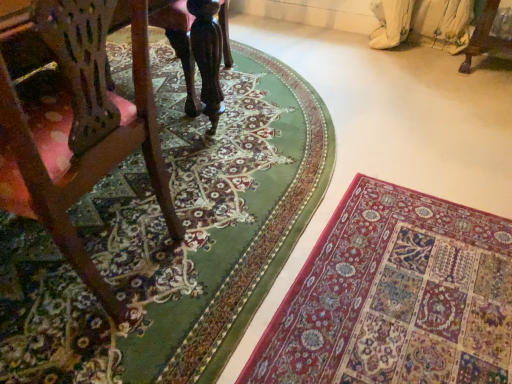
Question: Is wooden chair at left far from carpeted floor at lower right, the 1th mat when ordered from left to right?

Choices:
 (A) yes
 (B) no

Answer: (B)

Question: Is wooden chair at left closer to camera compared to carpeted floor at lower right, the 1th mat when ordered from left to right?

Choices:
 (A) yes
 (B) no

Answer: (A)

Question: From the image's perspective, is wooden chair at left beneath carpeted floor at lower right, the second mat when ordered from right to left?

Choices:
 (A) no
 (B) yes

Answer: (B)

Question: From a real-world perspective, is wooden chair at left under carpeted floor at lower right, the 1th mat when ordered from left to right?

Choices:
 (A) yes
 (B) no

Answer: (B)

Question: Can you confirm if wooden chair at left is bigger than carpeted floor at lower right, the second mat when ordered from right to left?

Choices:
 (A) no
 (B) yes

Answer: (B)

Question: From their relative heights in the image, would you say wooden chair at left is taller or shorter than carpeted floor at lower right, the second mat when ordered from right to left?

Choices:
 (A) tall
 (B) short

Answer: (A)

Question: From a real-world perspective, is wooden chair at left above or below carpeted floor at lower right, the 1th mat when ordered from left to right?

Choices:
 (A) below
 (B) above

Answer: (B)

Question: Does point (133, 137) appear closer or farther from the camera than point (270, 276)?

Choices:
 (A) closer
 (B) farther

Answer: (A)

Question: Would you say wooden chair at left is inside or outside carpeted floor at lower right, the 1th mat when ordered from left to right?

Choices:
 (A) outside
 (B) inside

Answer: (A)

Question: Is carpeted floor at lower right, the 1th mat when ordered from left to right, to the left or to the right of wooden chair at left in the image?

Choices:
 (A) left
 (B) right

Answer: (B)

Question: Is carpeted floor at lower right, the 1th mat when ordered from left to right, bigger or smaller than wooden chair at left?

Choices:
 (A) small
 (B) big

Answer: (A)

Question: From a real-world perspective, relative to wooden chair at left, is carpeted floor at lower right, the second mat when ordered from right to left, vertically above or below?

Choices:
 (A) below
 (B) above

Answer: (A)

Question: From the image's perspective, is carpeted floor at lower right, the second mat when ordered from right to left, located above or below wooden chair at left?

Choices:
 (A) below
 (B) above

Answer: (B)

Question: Is rich red carpet at lower right, the 2th mat in the left-to-right sequence, inside or outside of wooden chair at left?

Choices:
 (A) outside
 (B) inside

Answer: (A)

Question: Considering the positions of rich red carpet at lower right, positioned as the first mat in right-to-left order, and wooden chair at left in the image, is rich red carpet at lower right, positioned as the first mat in right-to-left order, wider or thinner than wooden chair at left?

Choices:
 (A) thin
 (B) wide

Answer: (B)